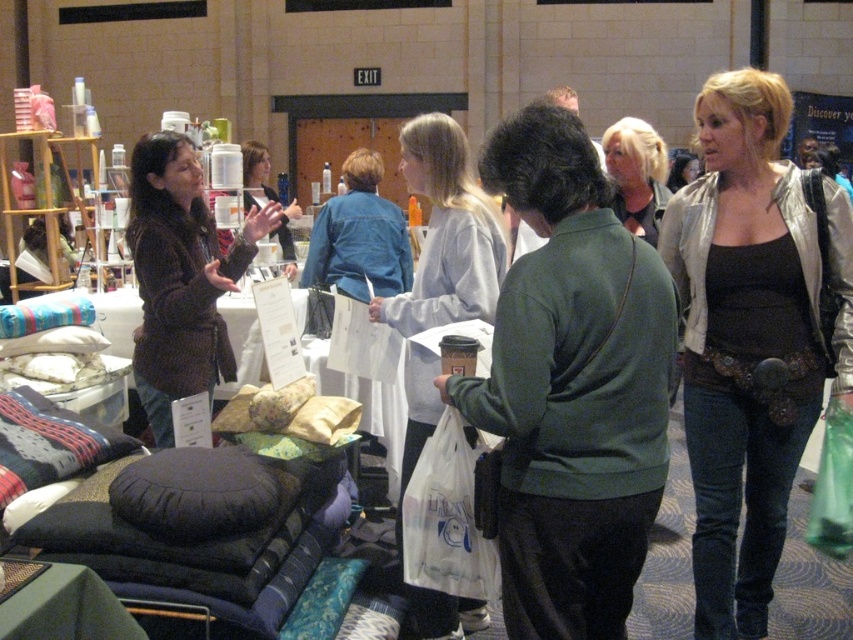
This screenshot has width=853, height=640. What do you see at coordinates (181, 276) in the screenshot?
I see `brown fuzzy sweater at upper left` at bounding box center [181, 276].

Measure the distance between point [160,376] and camera.

Point [160,376] and camera are 2.58 meters apart from each other.

The height and width of the screenshot is (640, 853). I want to click on brown fuzzy sweater at upper left, so click(181, 276).

Who is taller, brown fuzzy sweater at upper left or blonde hair at center?

brown fuzzy sweater at upper left is taller.

Who is more forward, [138,336] or [621,124]?

Point [138,336] is in front.

Who is more distant from viewer, (x=186, y=152) or (x=619, y=193)?

The point (x=619, y=193) is behind.

This screenshot has height=640, width=853. In order to click on brown fuzzy sweater at upper left in this screenshot , I will do `click(181, 276)`.

Identify the location of blonde hair at center. (636, 173).

Is point (621, 173) positioned before point (251, 182)?

Yes, point (621, 173) is closer to viewer.

In order to click on blonde hair at center in this screenshot , I will do `click(636, 173)`.